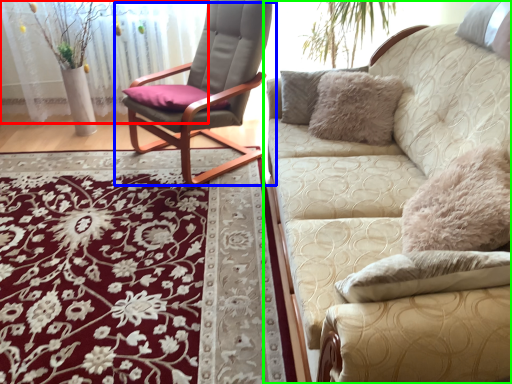
Question: Based on their relative distances, which object is nearer to glass door (highlighted by a red box)? Choose from chair (highlighted by a blue box) and studio couch (highlighted by a green box).

Choices:
 (A) chair
 (B) studio couch

Answer: (A)